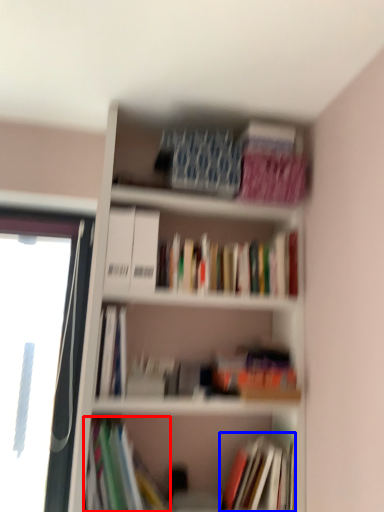
Question: Which object is further to the camera taking this photo, book (highlighted by a red box) or book (highlighted by a blue box)?

Choices:
 (A) book
 (B) book

Answer: (B)